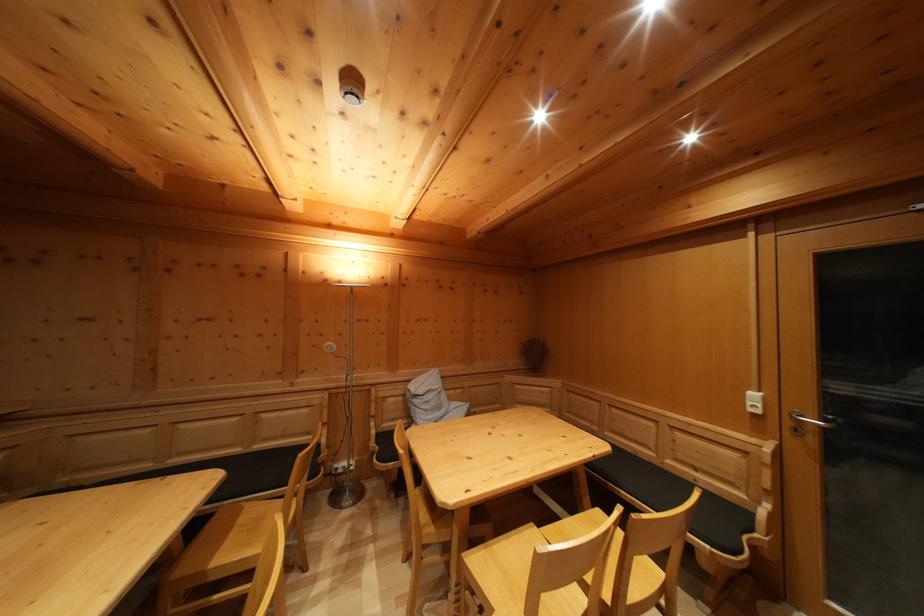
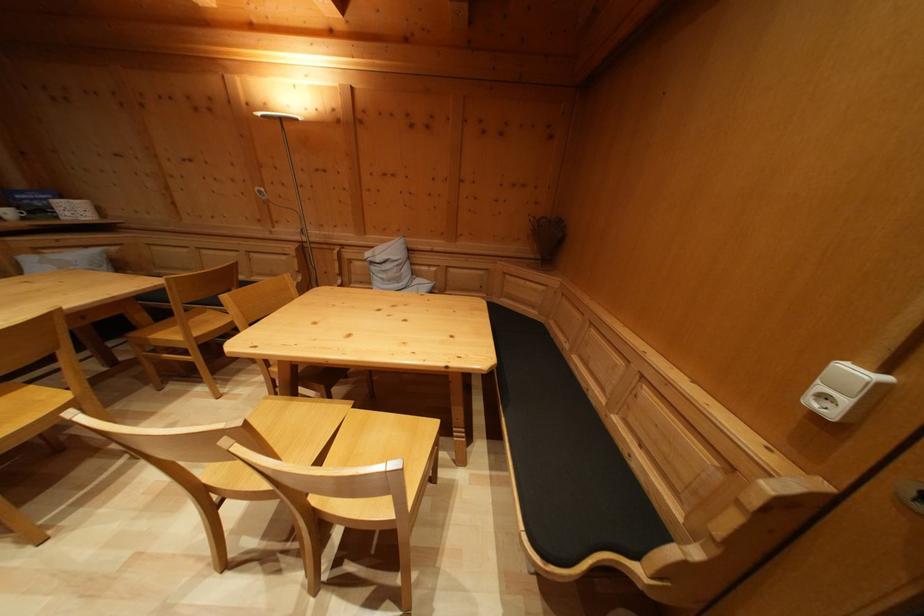
Find the pixel in the second image that matches (x=538, y=531) in the first image.

(359, 408)